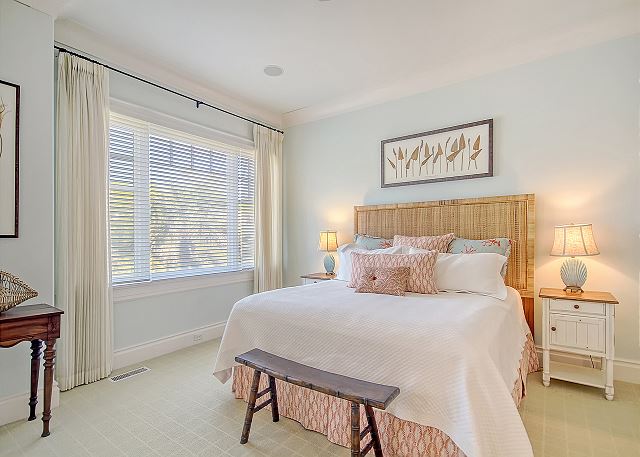
Where is `light or beige fabrics`? light or beige fabrics is located at coordinates (273, 209), (449, 270), (345, 258), (376, 336).